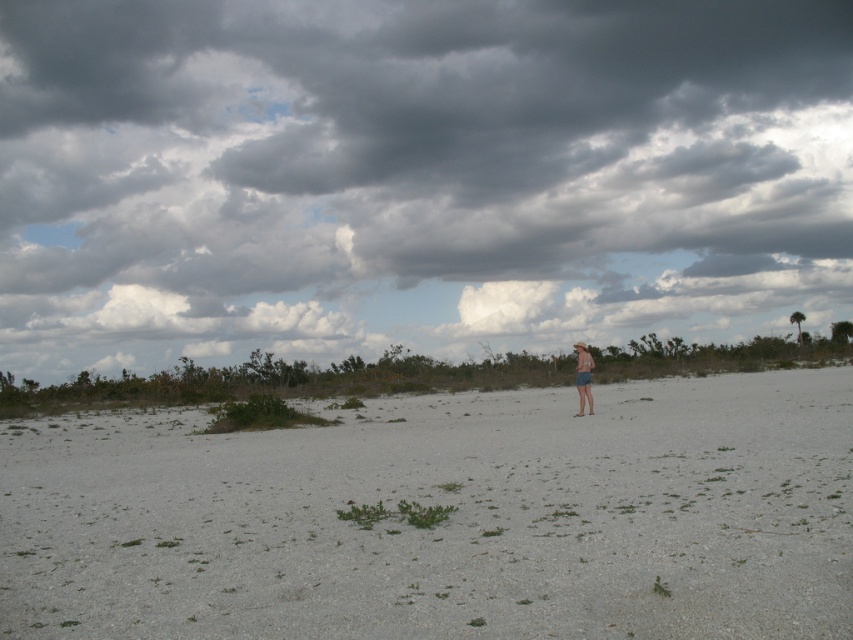
Looking at this image, can you confirm if dark gray cloud at upper center is taller than tan fabric shorts at center?

Correct, dark gray cloud at upper center is much taller as tan fabric shorts at center.

Which is above, dark gray cloud at upper center or tan fabric shorts at center?

dark gray cloud at upper center is higher up.

Does point (149, 132) come farther from viewer compared to point (579, 348)?

That is True.

In order to click on dark gray cloud at upper center in this screenshot , I will do `click(415, 177)`.

Can you confirm if white sand at center is positioned to the left of tan fabric shorts at center?

Correct, you'll find white sand at center to the left of tan fabric shorts at center.

Is point (280, 604) positioned in front of point (578, 356)?

That is True.

Where is `white sand at center`? The image size is (853, 640). white sand at center is located at coordinates (445, 518).

Who is lower down, dark gray cloud at upper center or white sand at center?

white sand at center is lower down.

Does point (236, 186) come in front of point (251, 596)?

No, it is behind (251, 596).

Is point (599, 36) positioned in front of point (688, 396)?

That is False.

The height and width of the screenshot is (640, 853). In order to click on dark gray cloud at upper center in this screenshot , I will do `click(415, 177)`.